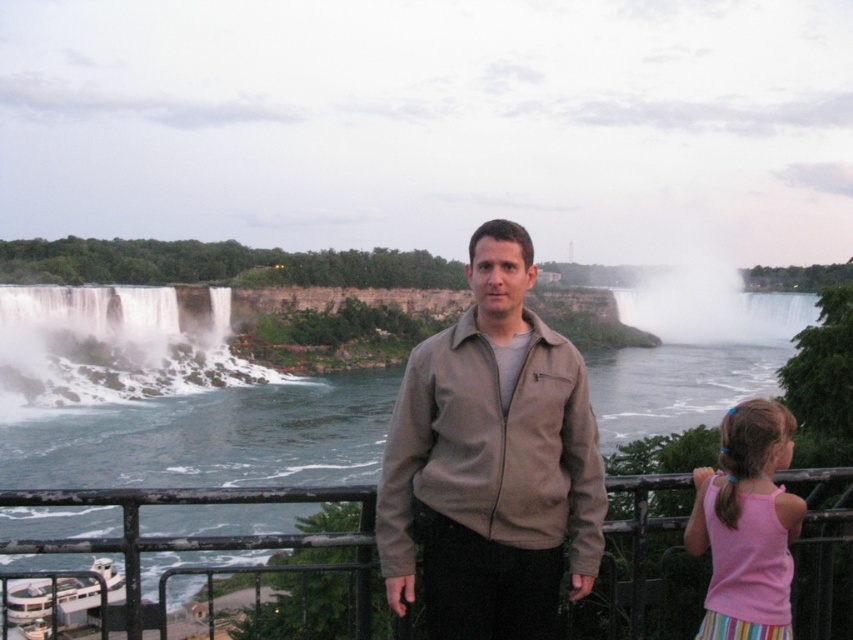
Between matte brown jacket at center and black metal railing at center, which one has more height?

With more height is matte brown jacket at center.

Which is behind, point (463, 586) or point (355, 534)?

Point (463, 586)

Where is `matte brown jacket at center`? The height and width of the screenshot is (640, 853). matte brown jacket at center is located at coordinates (491, 461).

Where is `matte brown jacket at center`? matte brown jacket at center is located at coordinates (491, 461).

Is matte brown jacket at center wider than pink fabric hairband at lower right?

No, matte brown jacket at center is not wider than pink fabric hairband at lower right.

What do you see at coordinates (491, 461) in the screenshot? I see `matte brown jacket at center` at bounding box center [491, 461].

Where is `matte brown jacket at center`? Image resolution: width=853 pixels, height=640 pixels. matte brown jacket at center is located at coordinates (491, 461).

Can you confirm if black metal railing at center is bigger than pink fabric hairband at lower right?

Yes.

Does black metal railing at center have a lesser width compared to pink fabric hairband at lower right?

In fact, black metal railing at center might be wider than pink fabric hairband at lower right.

Which is behind, point (189, 490) or point (776, 531)?

The point (189, 490) is behind.

This screenshot has width=853, height=640. Find the location of `black metal railing at center`. black metal railing at center is located at coordinates (199, 536).